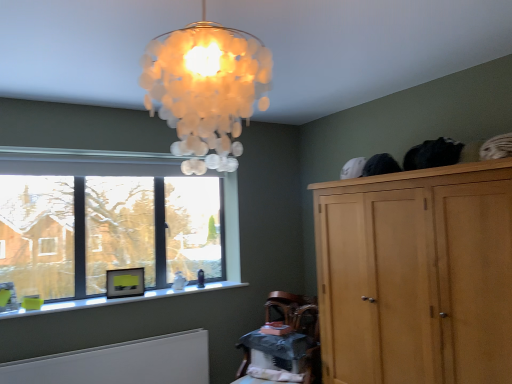
The image size is (512, 384). What do you see at coordinates (293, 311) in the screenshot?
I see `wooden armchair at lower center` at bounding box center [293, 311].

What is the approximate width of wooden armchair at lower center?

It is 19.75 inches.

The image size is (512, 384). What do you see at coordinates (120, 299) in the screenshot? I see `white glossy frame at lower left` at bounding box center [120, 299].

The width and height of the screenshot is (512, 384). Find the location of `light brown wooden cupboard at upper right`. light brown wooden cupboard at upper right is located at coordinates (416, 275).

Describe the element at coordinates (206, 89) in the screenshot. Image resolution: width=512 pixels, height=384 pixels. I see `translucent glass lampshade at upper center` at that location.

In order to click on white matte radiator at lower left in this screenshot , I will do `click(121, 362)`.

Considering the relative positions of translucent glass lampshade at upper center and wooden table at lower center in the image provided, is translucent glass lampshade at upper center to the right of wooden table at lower center from the viewer's perspective?

In fact, translucent glass lampshade at upper center is to the left of wooden table at lower center.

Is translucent glass lampshade at upper center in front of or behind wooden table at lower center in the image?

translucent glass lampshade at upper center is in front of wooden table at lower center.

From the image's perspective, which object appears higher, translucent glass lampshade at upper center or wooden table at lower center?

translucent glass lampshade at upper center appears higher in the image.

You are a GUI agent. You are given a task and a screenshot of the screen. Output one action in this format:
    pyautogui.click(x=<x>, y=<y>)
    Task: Click on the table that is below the translucent glass lampshade at upper center (from the image's perspective)
    Image resolution: width=512 pixels, height=384 pixels.
    Given the screenshot: What is the action you would take?
    pyautogui.click(x=275, y=348)

From a real-world perspective, between clear glass window at lower left and light brown wooden cupboard at upper right, who is vertically lower?

From a 3D spatial view, light brown wooden cupboard at upper right is below.

I want to click on cupboard on the right side of clear glass window at lower left, so click(416, 275).

Between point (147, 291) and point (413, 300), which one is positioned behind?

The point (147, 291) is behind.

Is light brown wooden cupboard at upper right located within clear glass window at lower left?

No, light brown wooden cupboard at upper right is not a part of clear glass window at lower left.

From a real-world perspective, is white glossy frame at lower left positioned above or below wooden armchair at lower center?

In terms of real-world spatial position, white glossy frame at lower left is above wooden armchair at lower center.

Is white glossy frame at lower left spatially inside wooden armchair at lower center, or outside of it?

white glossy frame at lower left lies outside wooden armchair at lower center.

Is white glossy frame at lower left oriented towards wooden armchair at lower center?

No, white glossy frame at lower left is not aimed at wooden armchair at lower center.

Who is shorter, white matte radiator at lower left or translucent glass lampshade at upper center?

Standing shorter between the two is white matte radiator at lower left.

The image size is (512, 384). I want to click on lamp on the right of the white matte radiator at lower left, so click(206, 89).

Does white matte radiator at lower left appear on the right side of translucent glass lampshade at upper center?

No, white matte radiator at lower left is not to the right of translucent glass lampshade at upper center.

Looking at this image, is white glossy frame at lower left to the left or to the right of white matte radiator at lower left in the image?

In the image, white glossy frame at lower left appears on the right side of white matte radiator at lower left.

Considering the relative sizes of white glossy frame at lower left and white matte radiator at lower left in the image provided, is white glossy frame at lower left smaller than white matte radiator at lower left?

Correct, white glossy frame at lower left occupies less space than white matte radiator at lower left.

Between white glossy frame at lower left and white matte radiator at lower left, which one has more height?

Standing taller between the two is white matte radiator at lower left.

Is translucent glass lampshade at upper center turned away from light brown wooden cupboard at upper right?

No, translucent glass lampshade at upper center is not facing the opposite direction of light brown wooden cupboard at upper right.

Considering the positions of objects translucent glass lampshade at upper center and light brown wooden cupboard at upper right in the image provided, who is more to the left, translucent glass lampshade at upper center or light brown wooden cupboard at upper right?

From the viewer's perspective, translucent glass lampshade at upper center appears more on the left side.

From the image's perspective, which is above, translucent glass lampshade at upper center or light brown wooden cupboard at upper right?

translucent glass lampshade at upper center is shown above in the image.

Between translucent glass lampshade at upper center and light brown wooden cupboard at upper right, which one has larger width?

light brown wooden cupboard at upper right is wider.

From the image's perspective, does white matte radiator at lower left appear higher than wooden armchair at lower center?

No, from the image's perspective, white matte radiator at lower left is not above wooden armchair at lower center.

Is white matte radiator at lower left not close to wooden armchair at lower center?

That's not correct — white matte radiator at lower left is a little close to wooden armchair at lower center.

Looking at this image, does white matte radiator at lower left have a larger size compared to wooden armchair at lower center?

Correct, white matte radiator at lower left is larger in size than wooden armchair at lower center.

From the picture: Considering the sizes of objects white matte radiator at lower left and wooden armchair at lower center in the image provided, who is wider, white matte radiator at lower left or wooden armchair at lower center?

wooden armchair at lower center is wider.

Locate an element on the screen. The height and width of the screenshot is (384, 512). table on the right of the translucent glass lampshade at upper center is located at coordinates (275, 348).

The image size is (512, 384). Identify the location of cupboard below the clear glass window at lower left (from the image's perspective). (416, 275).

Which object lies nearer to the anchor point translucent glass lampshade at upper center, light brown wooden cupboard at upper right or clear glass window at lower left?

Among the two, light brown wooden cupboard at upper right is located nearer to translucent glass lampshade at upper center.

Which object lies further to the anchor point white matte radiator at lower left, wooden armchair at lower center or translucent glass lampshade at upper center?

Among the two, translucent glass lampshade at upper center is located further to white matte radiator at lower left.

From the image, which object appears to be nearer to white matte radiator at lower left, white glossy frame at lower left or clear glass window at lower left?

white glossy frame at lower left lies closer to white matte radiator at lower left than the other object.

Based on their spatial positions, is white glossy frame at lower left or translucent glass lampshade at upper center closer to wooden table at lower center?

white glossy frame at lower left.

Consider the image. Which object lies further to the anchor point clear glass window at lower left, white matte radiator at lower left or wooden table at lower center?

Based on the image, wooden table at lower center appears to be further to clear glass window at lower left.

Looking at this image, based on their spatial positions, is white glossy frame at lower left or wooden armchair at lower center further from white matte radiator at lower left?

The object further to white matte radiator at lower left is wooden armchair at lower center.

Based on their spatial positions, is translucent glass lampshade at upper center or white glossy frame at lower left further from clear glass window at lower left?

Based on the image, translucent glass lampshade at upper center appears to be further to clear glass window at lower left.

Looking at this image, considering their positions, is clear glass window at lower left positioned closer to light brown wooden cupboard at upper right than white glossy frame at lower left?

Among the two, white glossy frame at lower left is located nearer to light brown wooden cupboard at upper right.

Identify the location of cupboard between translucent glass lampshade at upper center and wooden table at lower center from front to back. The height and width of the screenshot is (384, 512). (416, 275).

Where is `radiator between clear glass window at lower left and light brown wooden cupboard at upper right in the horizontal direction`? The width and height of the screenshot is (512, 384). radiator between clear glass window at lower left and light brown wooden cupboard at upper right in the horizontal direction is located at coordinates (121, 362).

Locate an element on the screen. window sill located between white matte radiator at lower left and light brown wooden cupboard at upper right in the left-right direction is located at coordinates (120, 299).

Locate an element on the screen. The image size is (512, 384). armchair situated between white glossy frame at lower left and light brown wooden cupboard at upper right from left to right is located at coordinates (293, 311).